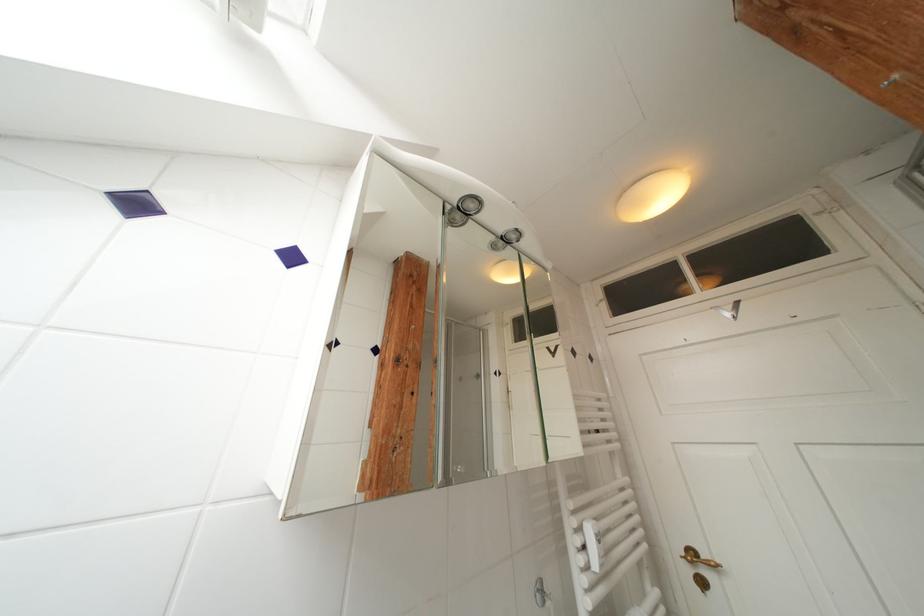
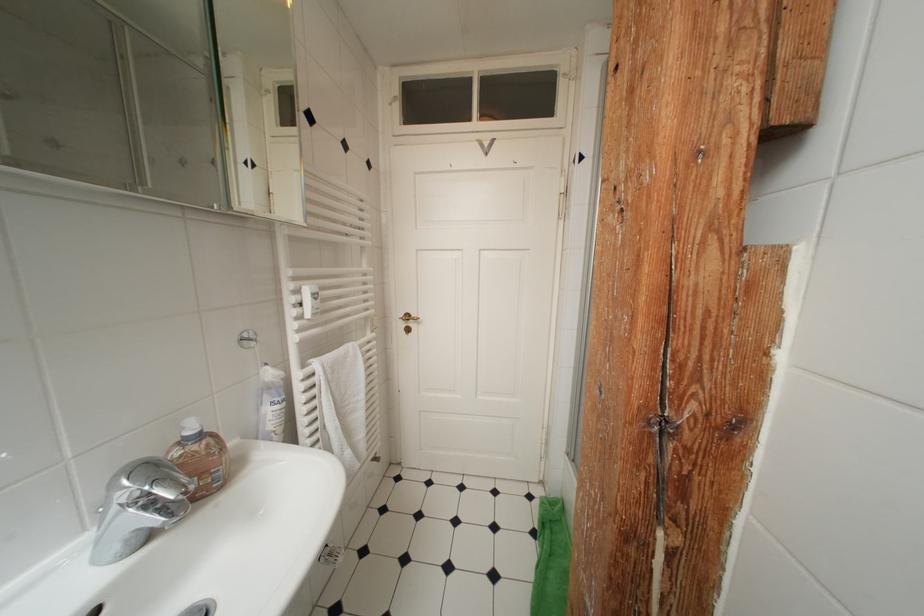
Question: I am providing you with two images of the same scene from different viewpoints. After the viewpoint changes to image2, which objects are now occluded?

Choices:
 (A) gold door handle
 (B) soap dispenser pump
 (C) cabinet mirror door
 (D) none of these

Answer: (D)